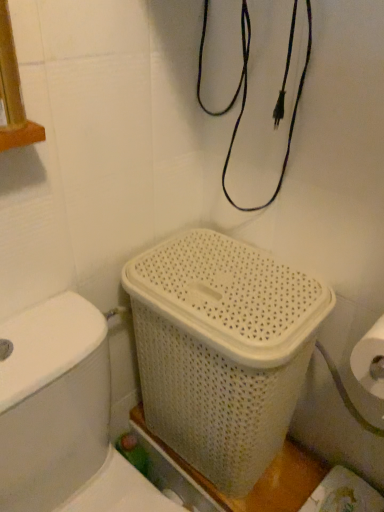
What do you see at coordinates (222, 350) in the screenshot? I see `white woven basket at center` at bounding box center [222, 350].

What is the approximate height of white woven basket at center?

white woven basket at center is 20.69 inches tall.

I want to click on white woven basket at center, so click(222, 350).

This screenshot has width=384, height=512. What do you see at coordinates (63, 416) in the screenshot? I see `white plastic toilet at lower left` at bounding box center [63, 416].

Find the location of `white plastic toilet at lower left`. white plastic toilet at lower left is located at coordinates (63, 416).

At what (x,y) coordinates should I click in order to perform the action: click on white woven basket at center. Please return your answer as a coordinate pair (x, y). Image resolution: width=384 pixels, height=512 pixels. Looking at the image, I should click on (222, 350).

Looking at this image, is white plastic toilet at lower left to the left of white woven basket at center from the viewer's perspective?

Indeed, white plastic toilet at lower left is positioned on the left side of white woven basket at center.

Is the position of white plastic toilet at lower left less distant than that of white woven basket at center?

Yes, white plastic toilet at lower left is in front of white woven basket at center.

Between point (16, 389) and point (156, 310), which one is positioned behind?

Positioned behind is point (156, 310).

From the image's perspective, is white plastic toilet at lower left under white woven basket at center?

Yes, from the image's perspective, white plastic toilet at lower left is beneath white woven basket at center.

From a real-world perspective, is white plastic toilet at lower left positioned above or below white woven basket at center?

Clearly, from a real-world perspective, white plastic toilet at lower left is below white woven basket at center.

Considering the sizes of objects white plastic toilet at lower left and white woven basket at center in the image provided, who is wider, white plastic toilet at lower left or white woven basket at center?

Wider between the two is white plastic toilet at lower left.

Considering the sizes of white plastic toilet at lower left and white woven basket at center in the image, is white plastic toilet at lower left taller or shorter than white woven basket at center?

In the image, white plastic toilet at lower left appears to be taller than white woven basket at center.

Based on their sizes in the image, would you say white plastic toilet at lower left is bigger or smaller than white woven basket at center?

Considering their sizes, white plastic toilet at lower left takes up more space than white woven basket at center.

In the scene shown: Is white plastic toilet at lower left completely or partially outside of white woven basket at center?

Indeed, white plastic toilet at lower left is completely outside white woven basket at center.

Would you say white plastic toilet at lower left is a long distance from white woven basket at center?

No, there isn't a large distance between white plastic toilet at lower left and white woven basket at center.

Is white plastic toilet at lower left aimed at white woven basket at center?

No, white plastic toilet at lower left is not oriented towards white woven basket at center.

How many degrees apart are the facing directions of white plastic toilet at lower left and white woven basket at center?

white plastic toilet at lower left and white woven basket at center are facing 85.9 degrees away from each other.

The width and height of the screenshot is (384, 512). I want to click on basket container that appears above the white plastic toilet at lower left (from the image's perspective), so click(222, 350).

Considering the relative positions of white woven basket at center and white plastic toilet at lower left in the image provided, is white woven basket at center to the left or to the right of white plastic toilet at lower left?

Clearly, white woven basket at center is on the right of white plastic toilet at lower left in the image.

Between white woven basket at center and white plastic toilet at lower left, which one is positioned in front?

white plastic toilet at lower left is in front.

Is point (269, 409) closer to camera compared to point (41, 482)?

No, it is not.

From the image's perspective, between white woven basket at center and white plastic toilet at lower left, who is located below?

white plastic toilet at lower left.

From a real-world perspective, which object rests below the other?

white plastic toilet at lower left, from a real-world perspective.

Can you confirm if white woven basket at center is wider than white plastic toilet at lower left?

In fact, white woven basket at center might be narrower than white plastic toilet at lower left.

Considering the sizes of white woven basket at center and white plastic toilet at lower left in the image, is white woven basket at center taller or shorter than white plastic toilet at lower left?

In the image, white woven basket at center appears to be shorter than white plastic toilet at lower left.

Which of these two, white woven basket at center or white plastic toilet at lower left, is bigger?

white plastic toilet at lower left.

Do you think white woven basket at center is within white plastic toilet at lower left, or outside of it?

white woven basket at center exists outside the volume of white plastic toilet at lower left.

Is white woven basket at center next to white plastic toilet at lower left?

No, white woven basket at center is not in contact with white plastic toilet at lower left.

Could you tell me if white woven basket at center is turned towards white plastic toilet at lower left?

Yes, white woven basket at center is aimed at white plastic toilet at lower left.

Measure the distance from white woven basket at center to white plastic toilet at lower left.

white woven basket at center and white plastic toilet at lower left are 20.92 centimeters apart from each other.

Where is `basket container located above the white plastic toilet at lower left (from the image's perspective)`? This screenshot has height=512, width=384. basket container located above the white plastic toilet at lower left (from the image's perspective) is located at coordinates (222, 350).

Where is `toilet on the left side of white woven basket at center`? This screenshot has width=384, height=512. toilet on the left side of white woven basket at center is located at coordinates (63, 416).

What are the coordinates of `basket container on the right of white plastic toilet at lower left` in the screenshot? It's located at (222, 350).